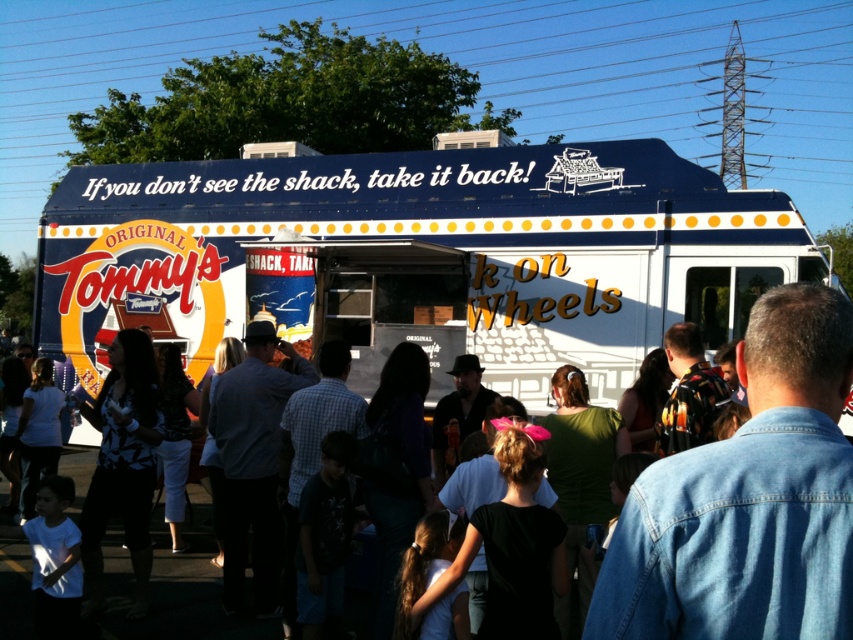
In the scene shown: You are a delivery person who needs to park your 2.5 meter wide delivery van next to the blue painted truck at center and denim jacket at center. Can you fit your van between them without overlapping?

The blue painted truck at center is narrower than the denim jacket at center, so the total space between them is less than 2.5 meters. Therefore, the delivery van cannot fit between them without overlapping.

You are a food truck customer standing at the denim jacket at center. You want to order from the Original Tommy Shack on Wheels. Can you reach the blue painted truck at center from your current position without moving closer than 12 feet?

The distance between the blue painted truck at center and the denim jacket at center is 14.02 feet, which is more than 12 feet. Therefore, you can reach the blue painted truck at center without moving closer than 12 feet.